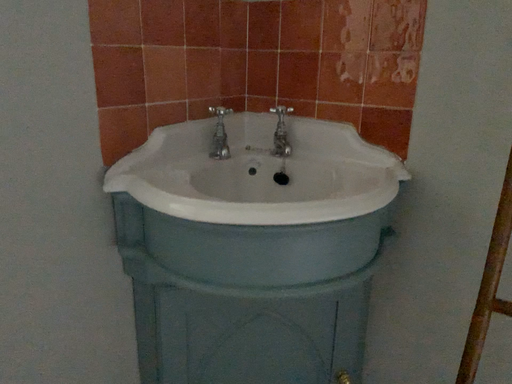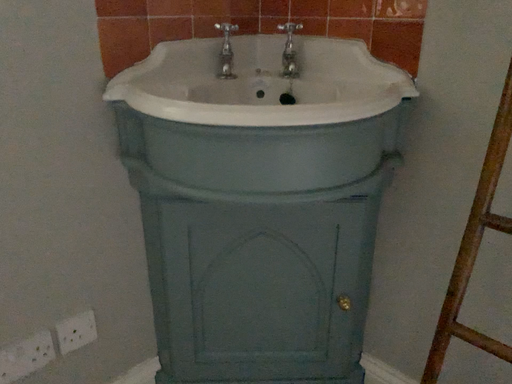
Question: How did the camera likely rotate when shooting the video?

Choices:
 (A) rotated right
 (B) rotated left

Answer: (B)